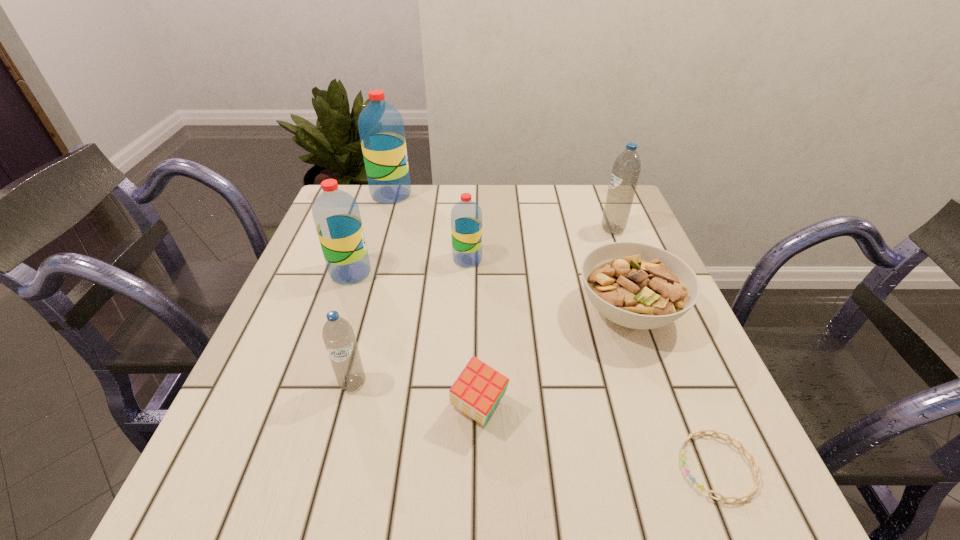
This screenshot has height=540, width=960. In order to click on cube in this screenshot , I will do `click(478, 389)`.

Identify the location of the shortest object. (757, 480).

You are a GUI agent. You are given a task and a screenshot of the screen. Output one action in this format:
    pyautogui.click(x=<x>, y=<y>)
    Task: Click on the bracelet
    Image resolution: width=960 pixels, height=540 pixels.
    Given the screenshot: What is the action you would take?
    pyautogui.click(x=757, y=480)

At what (x,y) coordinates should I click in order to perform the action: click on vacant space located on the front label of the tallest object. Please return your answer as a coordinate pair (x, y). The height and width of the screenshot is (540, 960). Looking at the image, I should click on (522, 194).

Find the location of a particular element. The width and height of the screenshot is (960, 540). vacant space located 0.200m on the front label of the second biggest red water bottle is located at coordinates (456, 273).

You are a GUI agent. You are given a task and a screenshot of the screen. Output one action in this format:
    pyautogui.click(x=<x>, y=<y>)
    Task: Click on the free space located on the front of the rightmost water bottle
    Image resolution: width=960 pixels, height=540 pixels.
    Given the screenshot: What is the action you would take?
    pyautogui.click(x=636, y=288)

Where is `vacant position located 0.350m on the front label of the smallest red water bottle`? vacant position located 0.350m on the front label of the smallest red water bottle is located at coordinates (625, 259).

This screenshot has height=540, width=960. What are the coordinates of `vacant region located 0.120m on the back of the smaller blue water bottle` in the screenshot? It's located at (368, 325).

Locate an element on the screen. The image size is (960, 540). vacant space located on the back of the gray stew is located at coordinates (587, 192).

Image resolution: width=960 pixels, height=540 pixels. What are the coordinates of `free space located 0.100m on the back of the cube` in the screenshot? It's located at (479, 340).